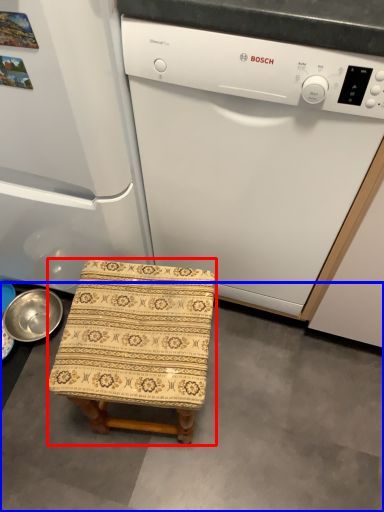
Question: Which of the following is the farthest to the observer, furniture (highlighted by a red box) or concrete (highlighted by a blue box)?

Choices:
 (A) furniture
 (B) concrete

Answer: (B)